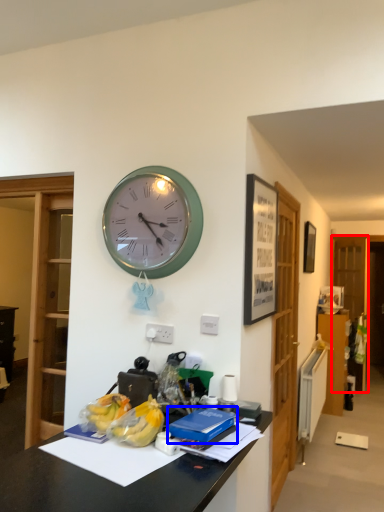
Question: Which point is further to the camera, glass door (highlighted by a red box) or book (highlighted by a blue box)?

Choices:
 (A) glass door
 (B) book

Answer: (A)